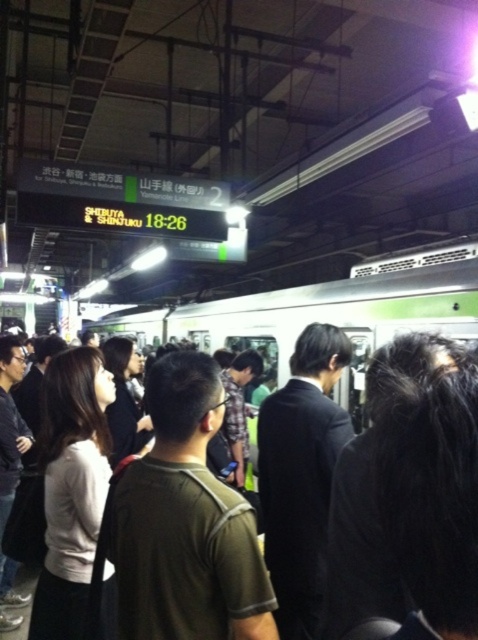
Question: Can you confirm if green metallic train at center is smaller than dark suit at center?

Choices:
 (A) yes
 (B) no

Answer: (B)

Question: Is dark green t-shirt at center bigger than black hair at center?

Choices:
 (A) no
 (B) yes

Answer: (B)

Question: Which of the following is the farthest from the observer?

Choices:
 (A) (194, 333)
 (B) (380, 412)
 (C) (76, 445)

Answer: (A)

Question: Which point is closer to the camera?

Choices:
 (A) dark green t-shirt at center
 (B) white matte shirt at center

Answer: (A)

Question: Does dark suit at center have a greater width compared to white leather shoes at lower left?

Choices:
 (A) no
 (B) yes

Answer: (A)

Question: Which point is farther from the camera taking this photo?

Choices:
 (A) (184, 529)
 (B) (154, 337)
 (C) (54, 593)

Answer: (B)